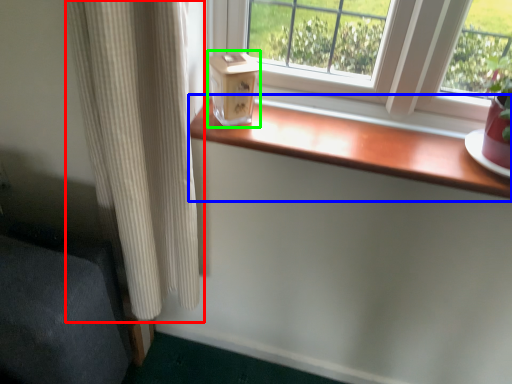
Question: Which object is the farthest from curtain (highlighted by a red box)? Choose among these: window sill (highlighted by a blue box) or window box (highlighted by a green box).

Choices:
 (A) window sill
 (B) window box

Answer: (A)